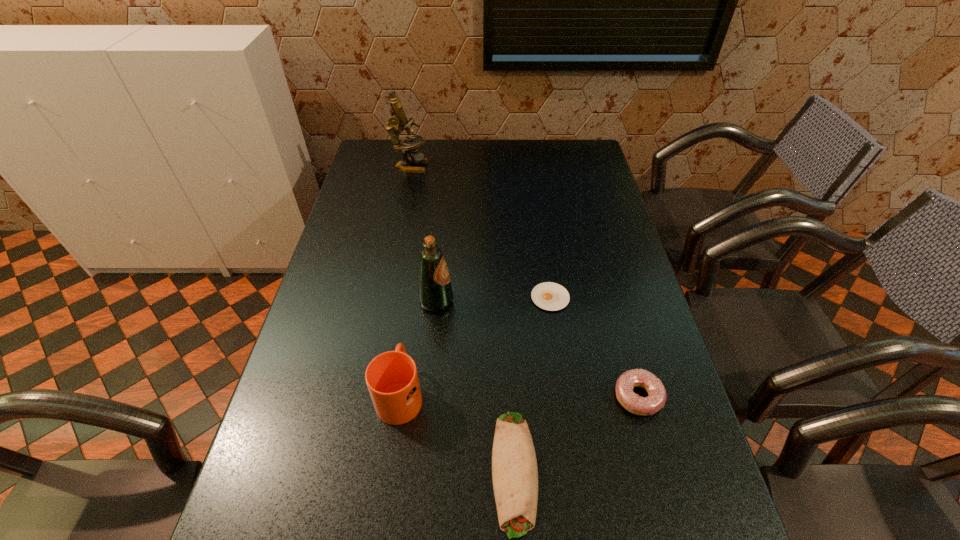
At what (x,y) coordinates should I click in order to perform the action: click on unoccupied position between the olive oil and the shortest object. Please return your answer as a coordinate pair (x, y). The image size is (960, 540). Looking at the image, I should click on (493, 300).

Select which object appears as the fourth closest to the doughnut. Please provide its 2D coordinates. Your answer should be formatted as a tuple, i.e. [(x, y)], where the tuple contains the x and y coordinates of a point satisfying the conditions above.

[(392, 379)]

Select which object is the third closest to the mug. Please provide its 2D coordinates. Your answer should be formatted as a tuple, i.e. [(x, y)], where the tuple contains the x and y coordinates of a point satisfying the conditions above.

[(550, 296)]

At what (x,y) coordinates should I click in order to perform the action: click on vacant space that satisfies the following two spatial constraints: 1. on the front side of the egg yolk; 2. on the right side of the fourth tallest object. Please return your answer as a coordinate pair (x, y). This screenshot has height=540, width=960. Looking at the image, I should click on (564, 396).

Locate an element on the screen. This screenshot has width=960, height=540. vacant space that satisfies the following two spatial constraints: 1. on the front side of the shortest object; 2. on the front-facing side of the olive oil is located at coordinates (551, 301).

Find the location of a particular element. The height and width of the screenshot is (540, 960). vacant position in the image that satisfies the following two spatial constraints: 1. on the back side of the fourth tallest object; 2. on the front-facing side of the fifth shortest object is located at coordinates (612, 301).

Image resolution: width=960 pixels, height=540 pixels. What are the coordinates of `vacant space that satisfies the following two spatial constraints: 1. on the front side of the egg yolk; 2. on the left side of the farthest object` in the screenshot? It's located at [x=383, y=298].